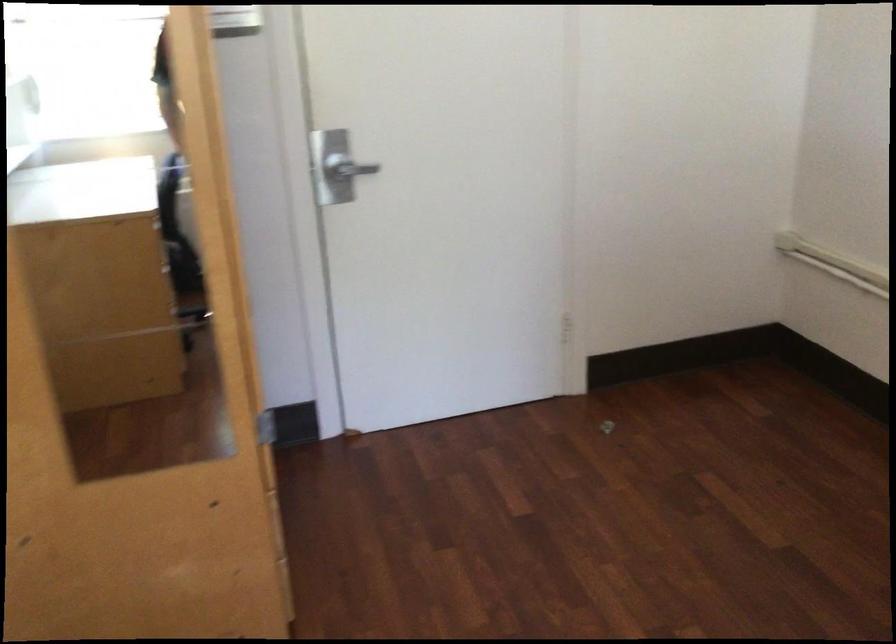
Find where to pull the silver door handle. Please return your answer as a coordinate pair (x, y).

(350, 174)